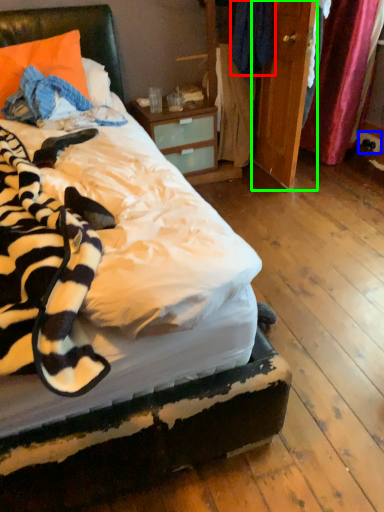
Question: Estimate the real-world distances between objects in this image. Which object is farther from clothing (highlighted by a red box), power outlet (highlighted by a blue box) or armoire (highlighted by a green box)?

Choices:
 (A) power outlet
 (B) armoire

Answer: (A)